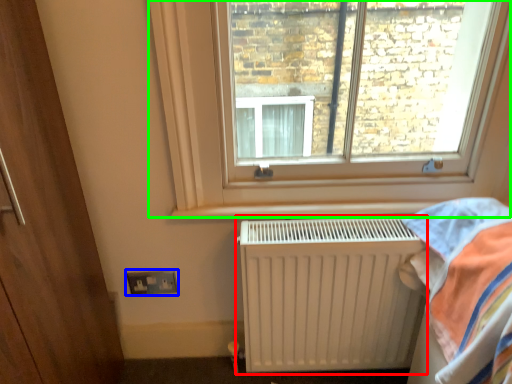
Question: Which is farther away from radiator (highlighted by a red box)? electric outlet (highlighted by a blue box) or window (highlighted by a green box)?

Choices:
 (A) electric outlet
 (B) window

Answer: (A)